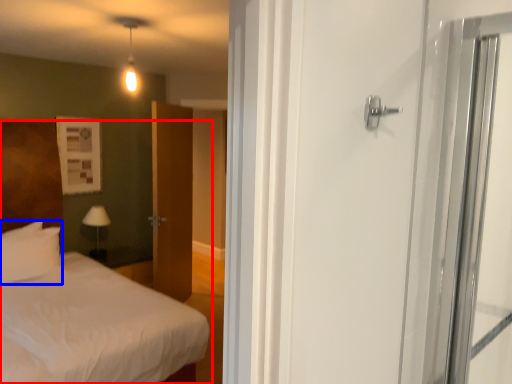
Question: Which point is further to the camera, bed (highlighted by a red box) or pillow (highlighted by a blue box)?

Choices:
 (A) bed
 (B) pillow

Answer: (B)